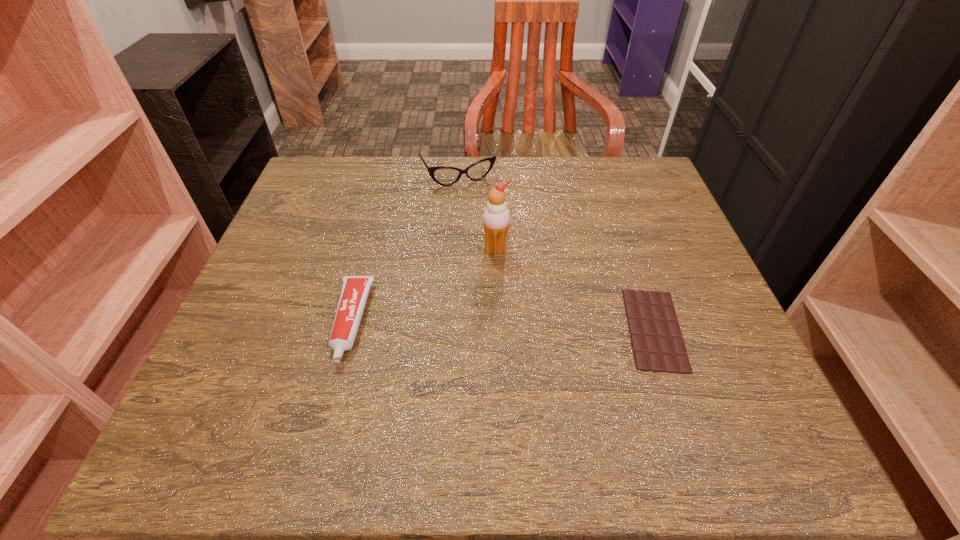
Where is `vacant space that is in between the leftmost object and the shortest object`? This screenshot has width=960, height=540. vacant space that is in between the leftmost object and the shortest object is located at coordinates (502, 325).

Where is `vacant point located between the spectacles and the tallest object`? This screenshot has width=960, height=540. vacant point located between the spectacles and the tallest object is located at coordinates (476, 212).

In order to click on free space between the leftmost object and the spectacles in this screenshot , I will do `click(404, 248)`.

At what (x,y) coordinates should I click in order to perform the action: click on free space that is in between the leftmost object and the second tallest object. Please return your answer as a coordinate pair (x, y). The width and height of the screenshot is (960, 540). Looking at the image, I should click on (404, 248).

Locate an element on the screen. free space between the tallest object and the third tallest object is located at coordinates (423, 286).

Find the location of `the closest object to the third tallest object`. the closest object to the third tallest object is located at coordinates (x=496, y=218).

Identify which object is the closest to the third shortest object. Please provide its 2D coordinates. Your answer should be formatted as a tuple, i.e. [(x, y)], where the tuple contains the x and y coordinates of a point satisfying the conditions above.

[(496, 218)]

Locate an element on the screen. The image size is (960, 540). vacant space that satisfies the following two spatial constraints: 1. on the front side of the icecream; 2. on the right side of the chocolate bar is located at coordinates (498, 329).

This screenshot has width=960, height=540. What are the coordinates of `vacant area in the image that satisfies the following two spatial constraints: 1. at the nozzle of the chocolate bar; 2. on the left side of the leftmost object` in the screenshot? It's located at (348, 329).

Where is `vacant point that satisfies the following two spatial constraints: 1. on the front side of the spectacles; 2. on the right side of the chocolate bar`? vacant point that satisfies the following two spatial constraints: 1. on the front side of the spectacles; 2. on the right side of the chocolate bar is located at coordinates (448, 329).